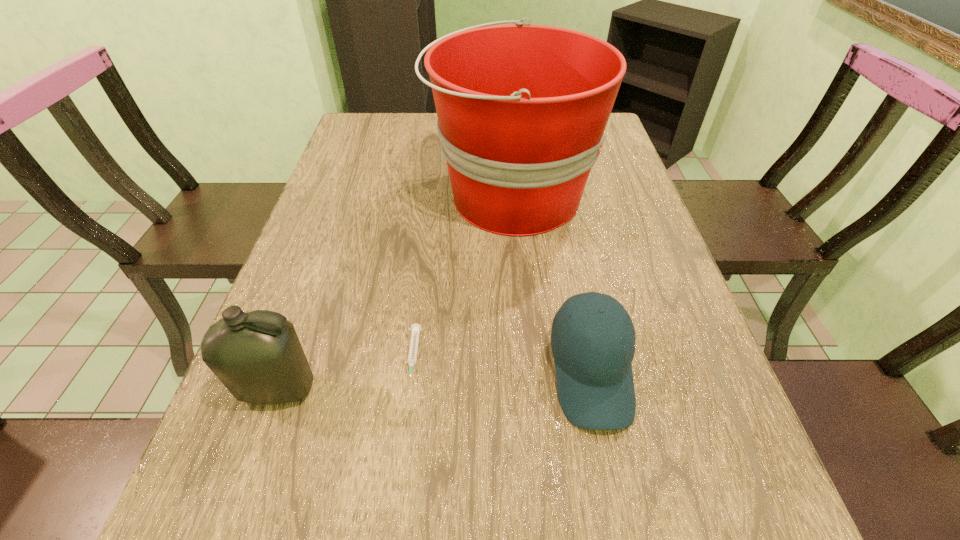
In order to click on vacant point located between the third tallest object and the tallest object in this screenshot , I will do `click(551, 285)`.

The image size is (960, 540). Identify the location of vacant area that lies between the leftmost object and the shortest object. (346, 373).

Identify the location of free point between the second shortest object and the farthest object. (551, 285).

I want to click on empty space that is in between the tallest object and the shortest object, so tap(463, 276).

You are a GUI agent. You are given a task and a screenshot of the screen. Output one action in this format:
    pyautogui.click(x=<x>, y=<y>)
    Task: Click on the blank region between the syringe and the bottle
    
    Given the screenshot: What is the action you would take?
    pyautogui.click(x=346, y=373)

This screenshot has width=960, height=540. I want to click on free space between the tallest object and the second tallest object, so click(x=395, y=293).

Locate which object is the closest to the farthest object. Please provide its 2D coordinates. Your answer should be formatted as a tuple, i.e. [(x, y)], where the tuple contains the x and y coordinates of a point satisfying the conditions above.

[(594, 376)]

Locate which object is the second closest to the third shortest object. Please provide its 2D coordinates. Your answer should be formatted as a tuple, i.e. [(x, y)], where the tuple contains the x and y coordinates of a point satisfying the conditions above.

[(522, 109)]

Where is `vacant point that satisfies the following two spatial constraints: 1. on the back side of the farthest object; 2. on the right side of the bottle`? Image resolution: width=960 pixels, height=540 pixels. vacant point that satisfies the following two spatial constraints: 1. on the back side of the farthest object; 2. on the right side of the bottle is located at coordinates (347, 197).